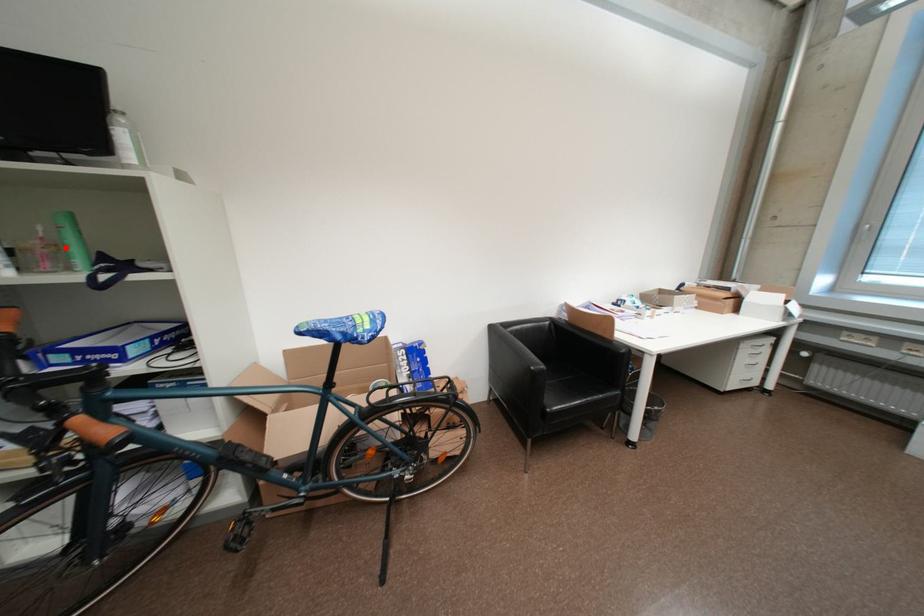
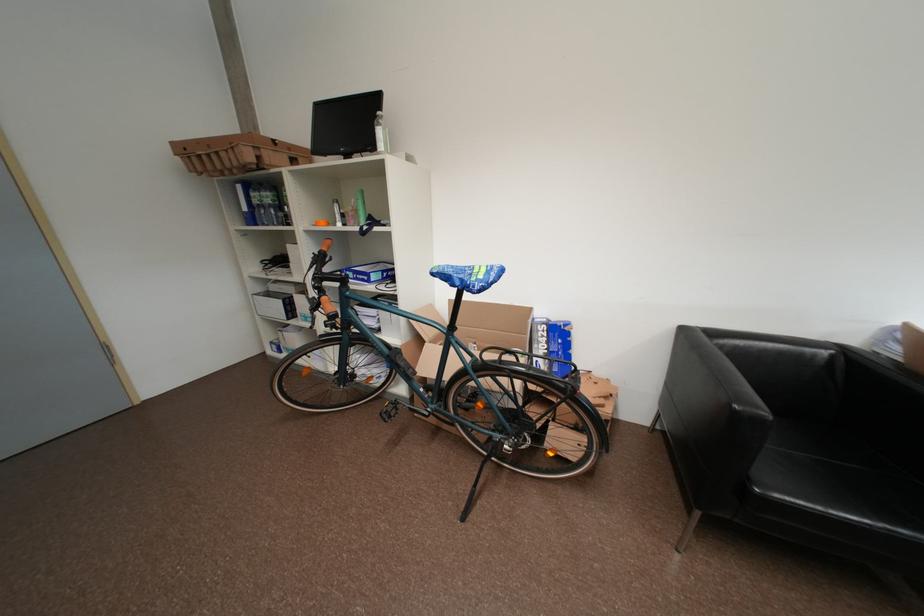
Question: I am providing you with two images of the same scene from different viewpoints. Given a red point in image1, look at the same physical point in image2. Is it:

Choices:
 (A) Closer to the viewpoint
 (B) Farther from the viewpoint

Answer: (A)